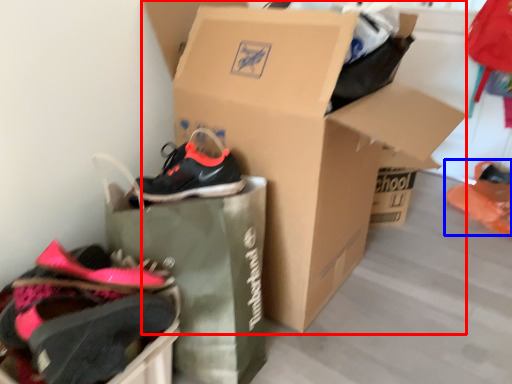
Question: Which object is closer to the camera taking this photo, box (highlighted by a red box) or footwear (highlighted by a blue box)?

Choices:
 (A) box
 (B) footwear

Answer: (A)